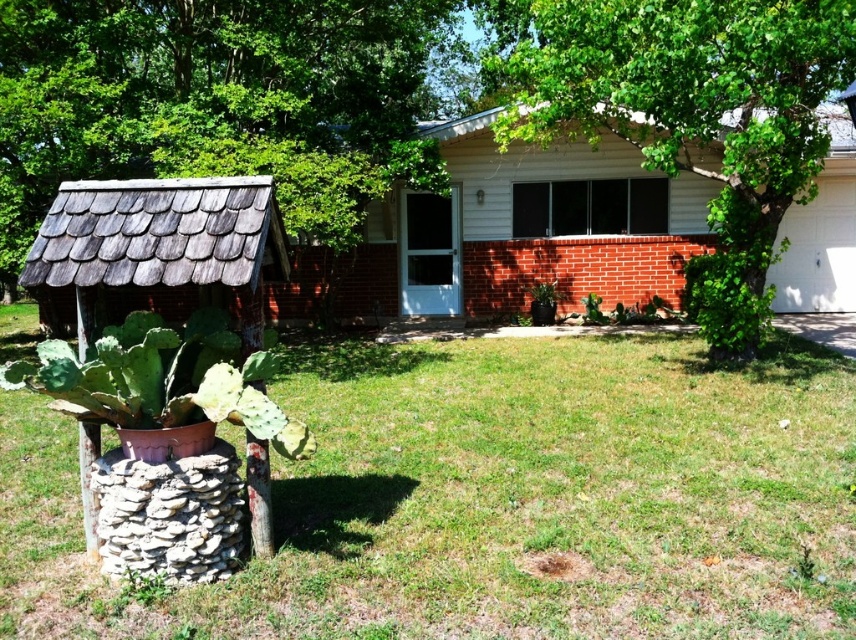
You are standing in front of the house and see the point marked at coordinates (494, 499). What is located at that point?

The point at coordinates (494, 499) is where the green grass at lower center is located.

You are a gardener who wants to plant a new tree in the yard. You notice two existing trees, the green leafy tree at left and the green leafy tree at center. Which tree has a smaller trunk diameter?

The green leafy tree at left has a smaller trunk diameter than the green leafy tree at center.